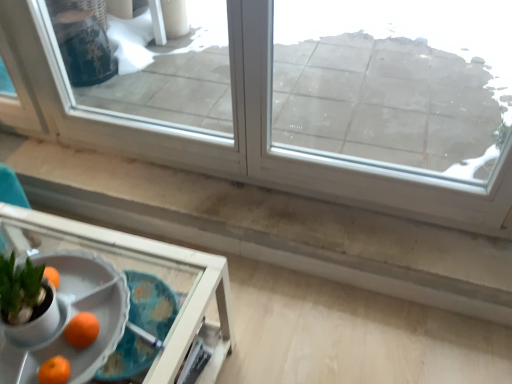
Question: Considering the positions of orange matte at lower left and transparent glass window at upper center, the 1th window positioned from the left, in the image, is orange matte at lower left wider or thinner than transparent glass window at upper center, the 1th window positioned from the left,?

Choices:
 (A) wide
 (B) thin

Answer: (B)

Question: From a real-world perspective, is orange matte at lower left above or below transparent glass window at upper center, the second window from the right?

Choices:
 (A) below
 (B) above

Answer: (A)

Question: Which object is positioned farthest from the transparent glass window at upper center, the second window from the right?

Choices:
 (A) white plastic tray at lower left
 (B) orange matte at lower left
 (C) transparent glass window at upper center, the second window positioned from the left

Answer: (C)

Question: Which object is the closest to the transparent glass window at upper center, the 1th window positioned from the left?

Choices:
 (A) white plastic tray at lower left
 (B) transparent glass window at upper center, the second window positioned from the left
 (C) orange matte at lower left

Answer: (A)